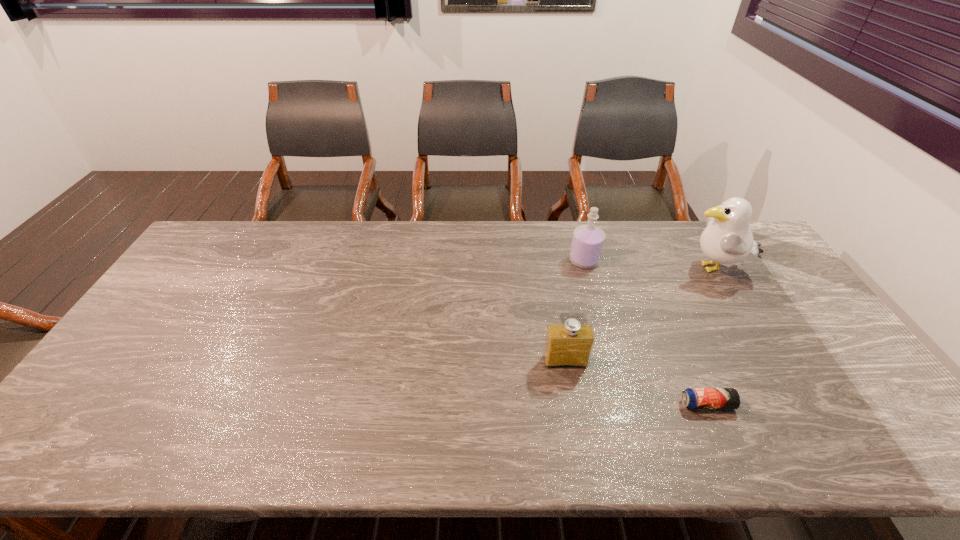
This screenshot has width=960, height=540. I want to click on free space at the left edge of the desktop, so click(x=228, y=267).

Identify the location of vacant area at the right edge of the desktop. The height and width of the screenshot is (540, 960). (839, 403).

In the image, there is a desktop. Where is `vacant space at the near right corner`? The image size is (960, 540). vacant space at the near right corner is located at coordinates (900, 454).

Where is `free space between the taller perfume and the shorter perfume`? This screenshot has width=960, height=540. free space between the taller perfume and the shorter perfume is located at coordinates (575, 311).

Image resolution: width=960 pixels, height=540 pixels. In order to click on free space that is in between the rightmost object and the third shortest object in this screenshot , I will do `click(649, 265)`.

The image size is (960, 540). I want to click on free spot between the rightmost object and the nearest object, so tap(710, 337).

Where is `empty space that is in between the shortest object and the taller perfume`? Image resolution: width=960 pixels, height=540 pixels. empty space that is in between the shortest object and the taller perfume is located at coordinates (646, 333).

What are the coordinates of `vacant area that lies between the rightmost object and the nearer perfume` in the screenshot? It's located at (639, 315).

Find the location of a particular element. This screenshot has height=540, width=960. empty space that is in between the taller perfume and the leftmost object is located at coordinates (575, 311).

This screenshot has width=960, height=540. In order to click on free point between the beer can and the leftmost object in this screenshot , I will do pyautogui.click(x=636, y=383).